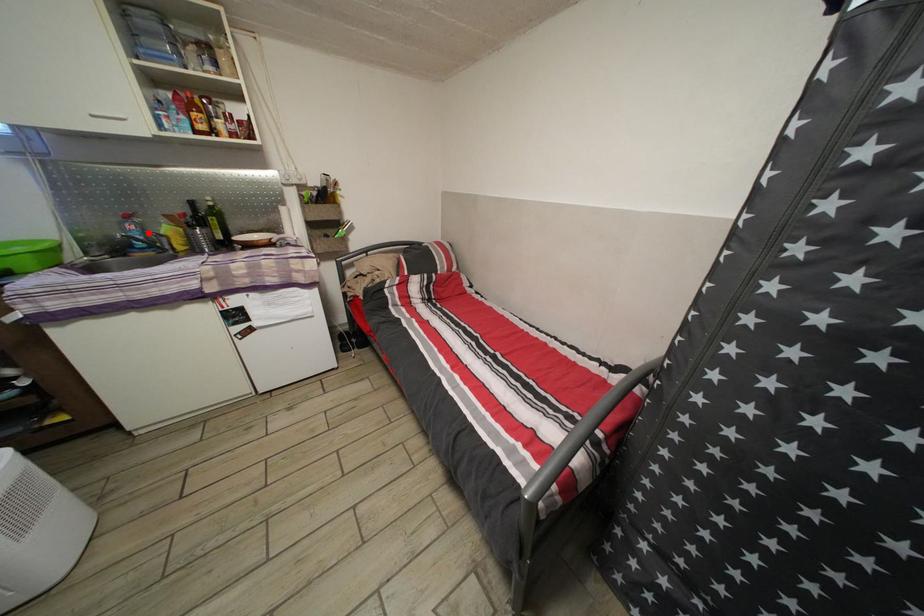
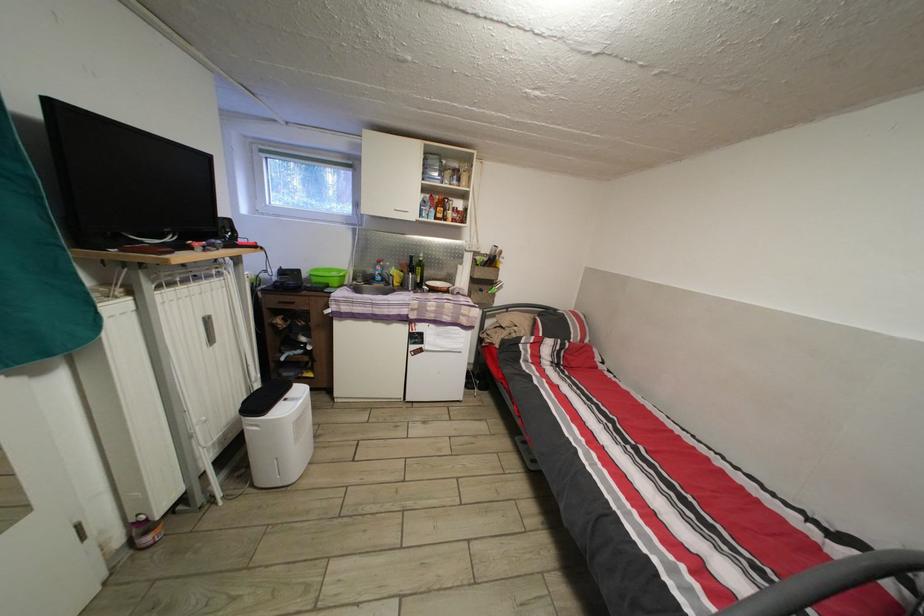
Where in the second image is the point corresponding to the highlighted location from the first image?

(390, 274)